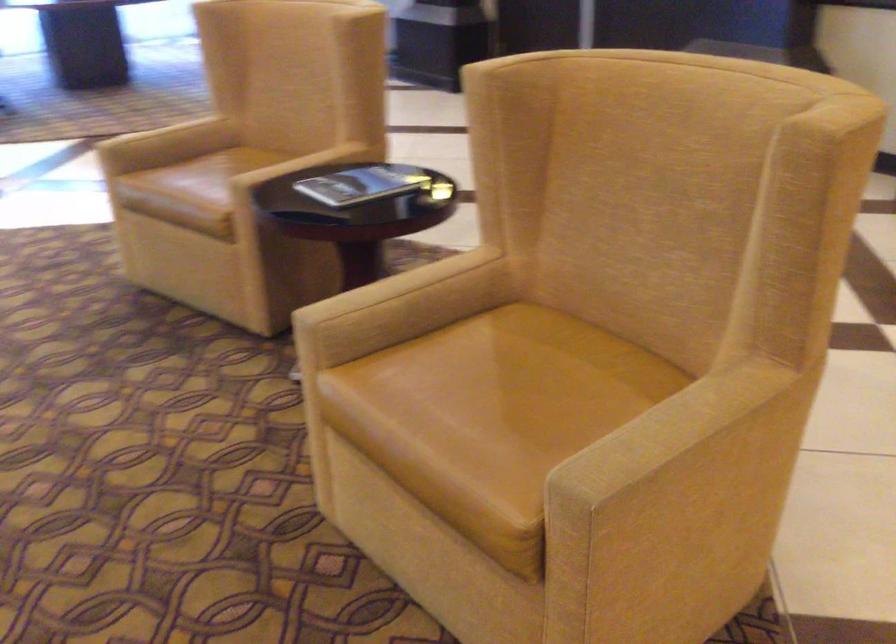
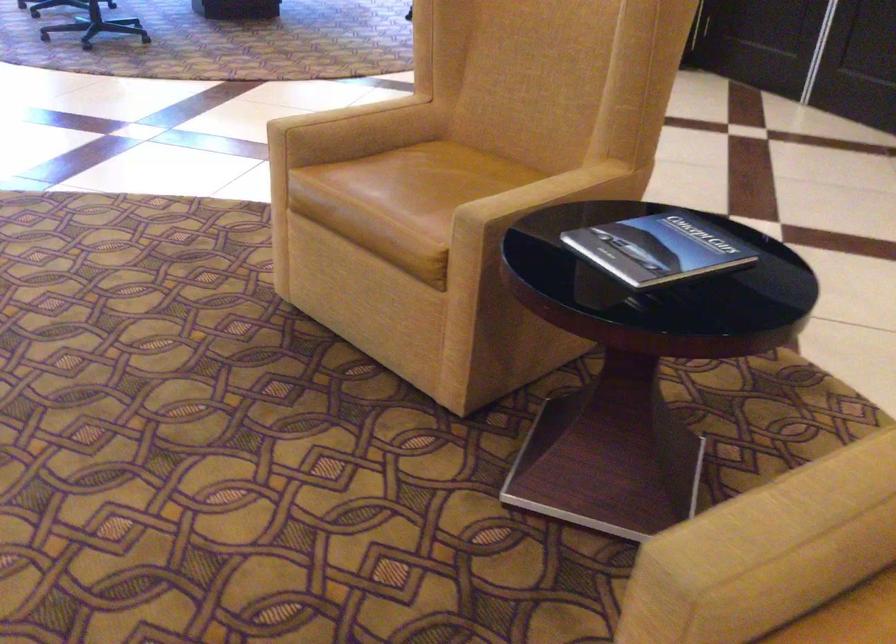
Find the pixel in the second image that matches (x=375, y=308) in the first image.

(778, 543)